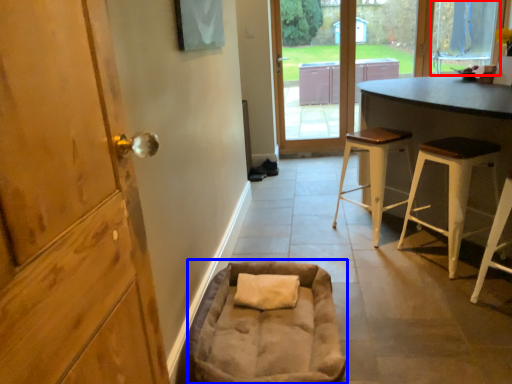
Question: Which object appears closest to the camera in this image, window (highlighted by a red box) or bean bag chair (highlighted by a blue box)?

Choices:
 (A) window
 (B) bean bag chair

Answer: (B)